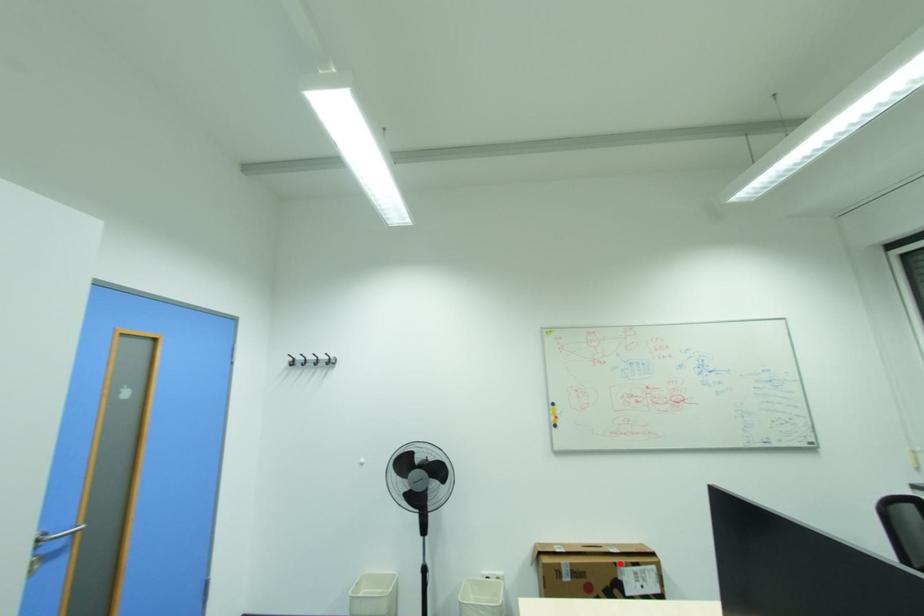
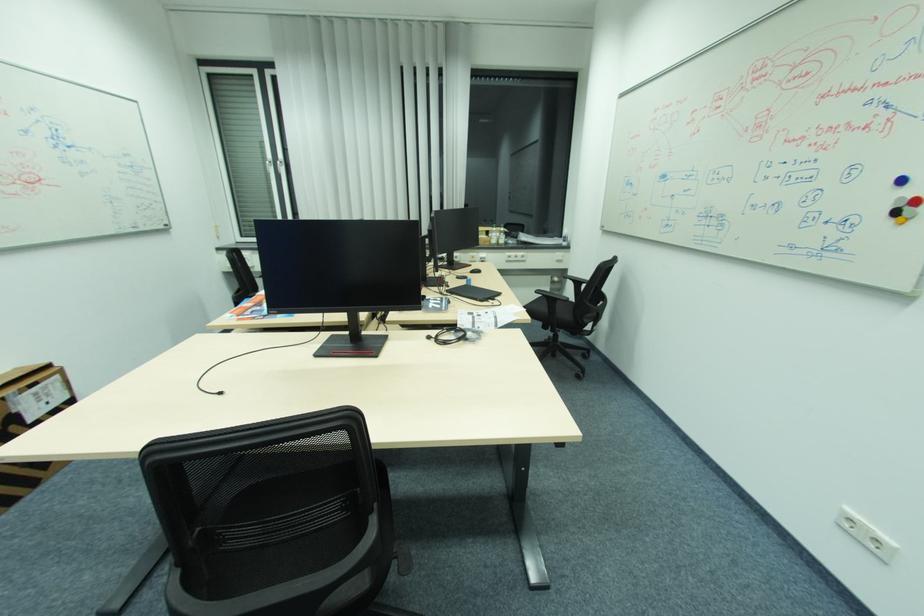
Where in the second image is the point corresponding to the highlighted location from the first image?

(7, 399)